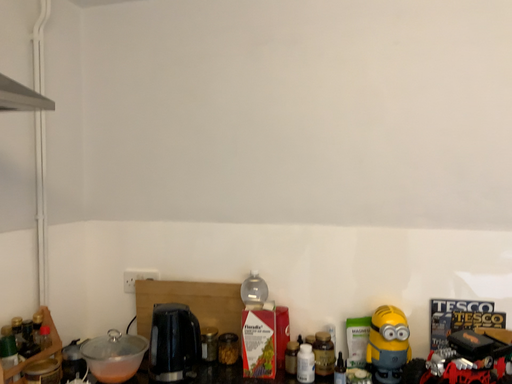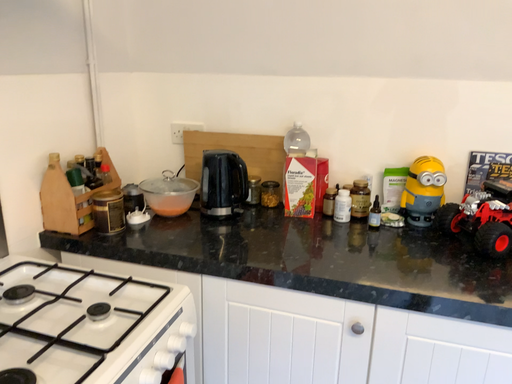
Question: Which way did the camera rotate in the video?

Choices:
 (A) rotated downward
 (B) rotated upward

Answer: (A)